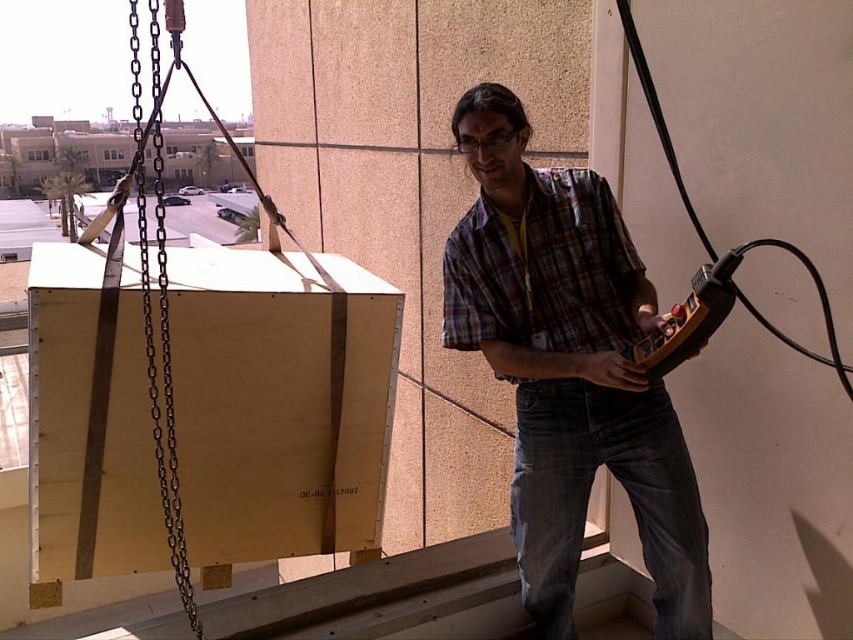
You are a safety inspector checking the crane operation area. You notice the plaid shirt at center and the black metal chain at left. Which object is closer to your viewpoint?

The plaid shirt at center is closer to the viewer than the black metal chain at left.

You are standing in the same room as the man operating the crane remote. You need to hand him a tool that is on the floor near your feet. The plaid shirt at center is the man you need to reach. Can you comfortably reach him to hand him the tool without moving from your current position?

The plaid shirt at center is 5.43 feet away from the viewer. Since this distance is within a typical comfortable reaching range of about 5 feet, you can likely hand the tool to the man without needing to move closer.